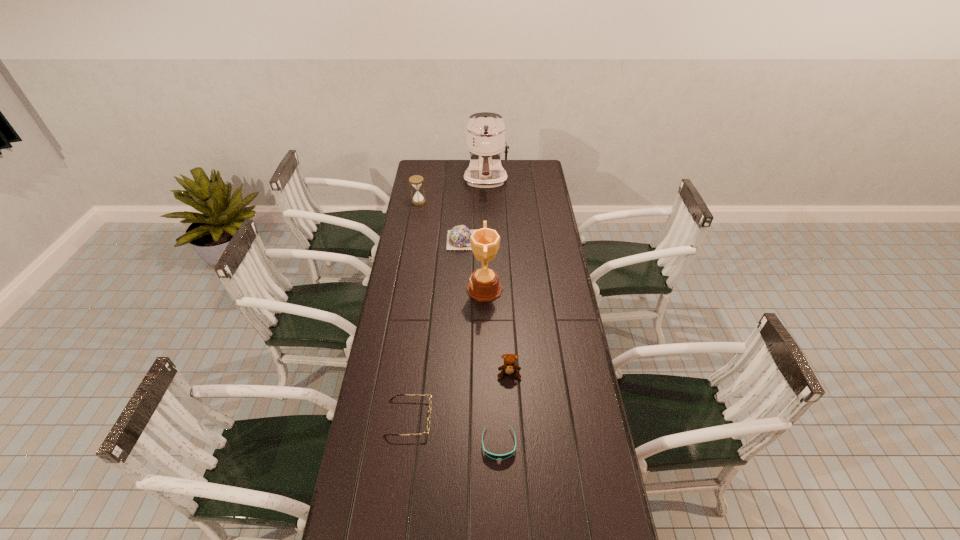
Find the location of `hourglass located at the left edge`. hourglass located at the left edge is located at coordinates (416, 180).

Locate an element on the screen. This screenshot has height=540, width=960. spectacles that is at the left edge is located at coordinates (430, 404).

Identify the location of vacant area at the far edge. The height and width of the screenshot is (540, 960). pyautogui.click(x=447, y=173).

At what (x,y) coordinates should I click in order to perform the action: click on vacant space at the left edge of the desktop. Please return your answer as a coordinate pair (x, y). The image size is (960, 540). Looking at the image, I should click on (396, 287).

This screenshot has height=540, width=960. I want to click on free space at the right edge of the desktop, so click(x=602, y=526).

In the image, there is a desktop. Where is `blank space at the far right corner`? The height and width of the screenshot is (540, 960). blank space at the far right corner is located at coordinates pos(530,164).

Find the location of a particular element. free spot between the hourglass and the coffee maker is located at coordinates (452, 191).

Identify the location of free spot between the cap and the second shortest object. This screenshot has height=540, width=960. (440, 329).

This screenshot has height=540, width=960. I want to click on free space between the shortest object and the third shortest object, so click(x=485, y=342).

Find the location of a particular element. The image size is (960, 540). free space between the hourglass and the sunglasses is located at coordinates pos(459,323).